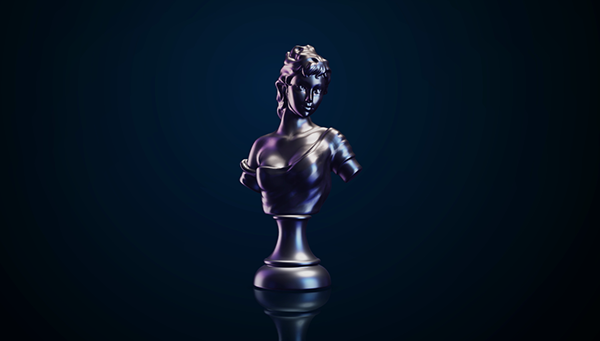
Find the location of a particular element. This screenshot has height=341, width=600. base of statue, bottom center is located at coordinates (287, 291).